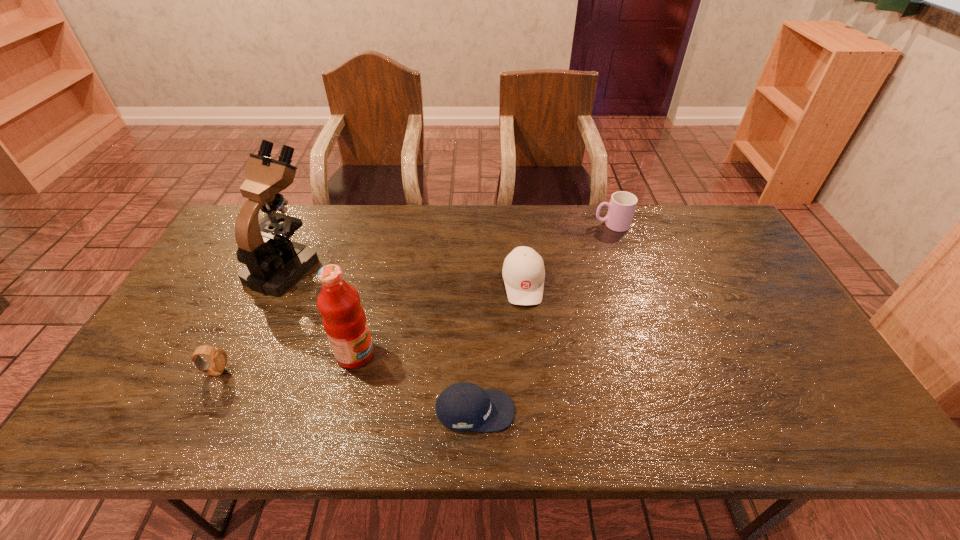
You are a GUI agent. You are given a task and a screenshot of the screen. Output one action in this format:
    pyautogui.click(x=<x>, y=<y>)
    Task: Click on the object that is at the left edge
    The image size is (960, 540).
    Given the screenshot: What is the action you would take?
    pyautogui.click(x=274, y=263)

In order to click on object located at the far left corner in this screenshot , I will do `click(274, 263)`.

In the image, there is a desktop. In order to click on free space at the far edge in this screenshot , I will do `click(651, 237)`.

Find the location of a particular element. This screenshot has height=540, width=960. vacant space at the near edge of the desktop is located at coordinates (315, 416).

This screenshot has height=540, width=960. In the image, there is a desktop. What are the coordinates of `free region at the left edge` in the screenshot? It's located at (183, 384).

I want to click on vacant region at the right edge of the desktop, so click(747, 300).

The image size is (960, 540). I want to click on free space between the shorter baseball cap and the watch, so click(346, 391).

Where is `vacant area that lies between the rightmost object and the watch`? vacant area that lies between the rightmost object and the watch is located at coordinates (414, 298).

The width and height of the screenshot is (960, 540). I want to click on vacant space that is in between the taller baseball cap and the farthest object, so click(567, 254).

Where is `empty location between the watch and the microscope`? The height and width of the screenshot is (540, 960). empty location between the watch and the microscope is located at coordinates (251, 319).